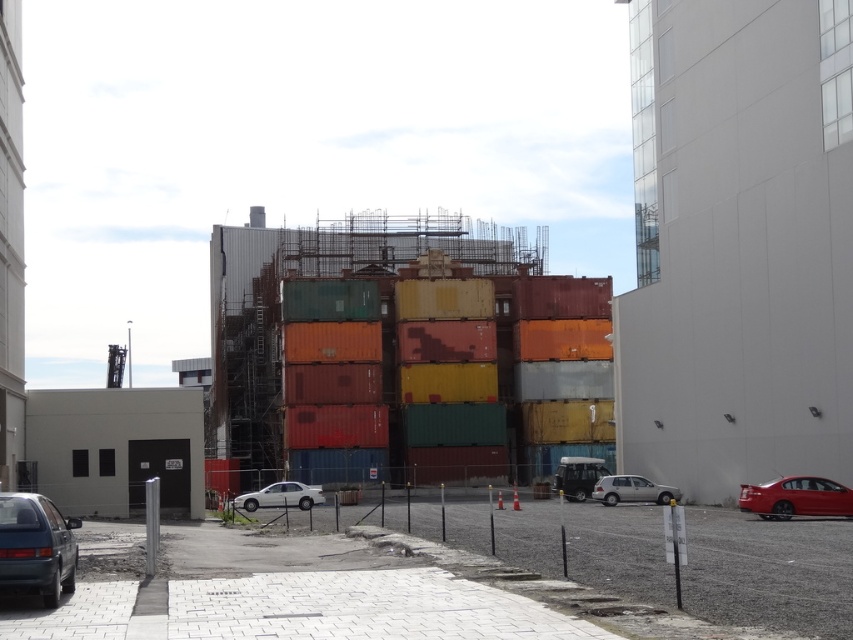
Which is behind, point (799, 515) or point (271, 488)?

Point (271, 488)

Can you confirm if shiny red sedan at lower right is bigger than white glossy sedan at center?

No, shiny red sedan at lower right is not bigger than white glossy sedan at center.

Is point (820, 480) more distant than point (258, 492)?

No.

Locate an element on the screen. shiny red sedan at lower right is located at coordinates (795, 497).

Looking at this image, is matte gray hatchback at lower left below shiny red sedan at lower right?

No.

In the scene shown: Is the position of matte gray hatchback at lower left less distant than that of shiny red sedan at lower right?

Yes, matte gray hatchback at lower left is in front of shiny red sedan at lower right.

At what (x,y) coordinates should I click in order to perform the action: click on matte gray hatchback at lower left. Please return your answer as a coordinate pair (x, y). The image size is (853, 640). Looking at the image, I should click on (36, 547).

Between point (61, 582) and point (277, 506), which one is positioned in front?

Point (61, 582) is more forward.

Is matte gray hatchback at lower left positioned behind white glossy sedan at center?

No, it is in front of white glossy sedan at center.

Does point (9, 552) lie behind point (234, 502)?

That is False.

This screenshot has height=640, width=853. Find the location of `matte gray hatchback at lower left`. matte gray hatchback at lower left is located at coordinates (36, 547).